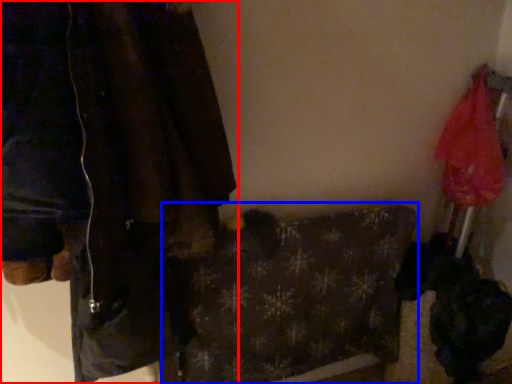
Question: Which object appears farthest to the camera in this image, jacket (highlighted by a red box) or blanket (highlighted by a blue box)?

Choices:
 (A) jacket
 (B) blanket

Answer: (B)